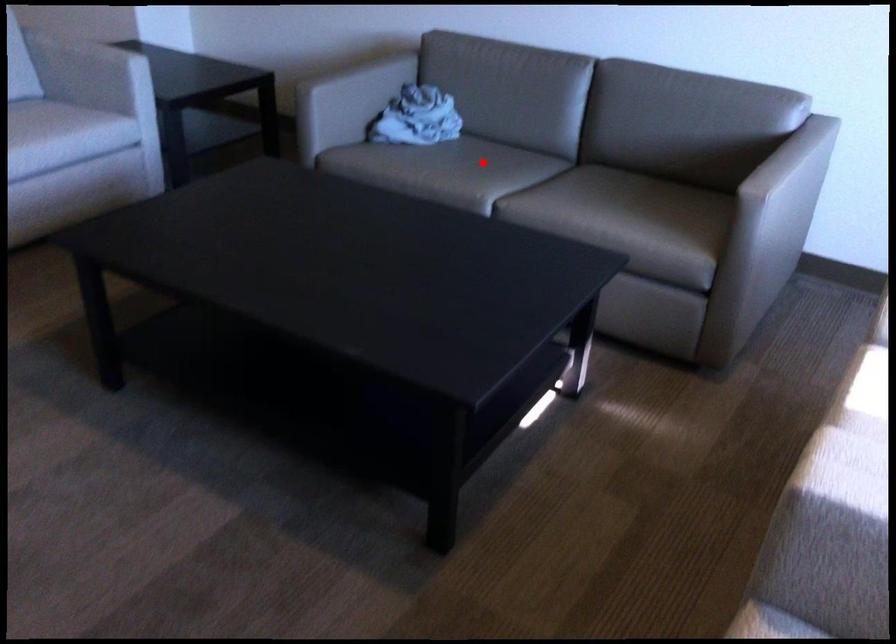
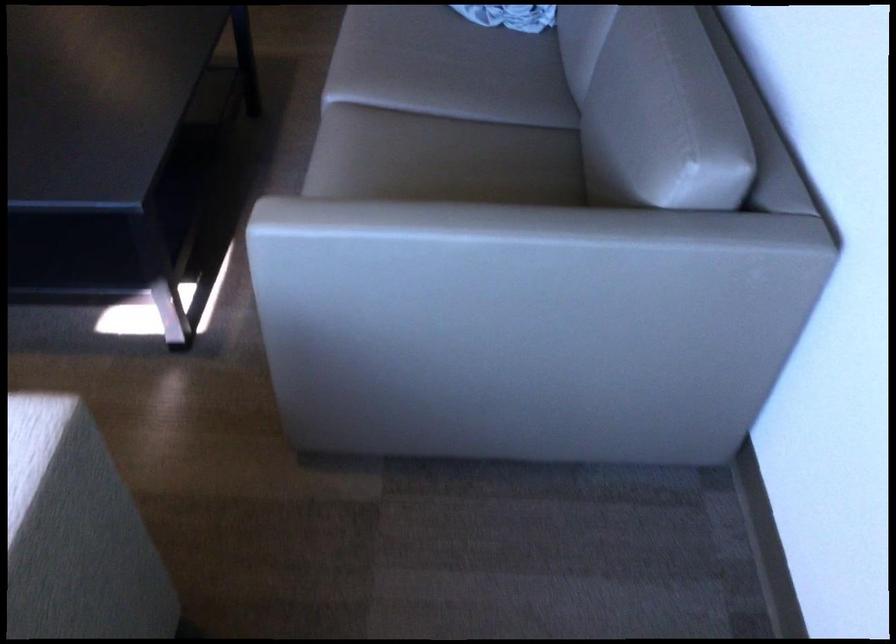
Find the pixel in the second image that matches the highlighted location in the first image.

(463, 73)